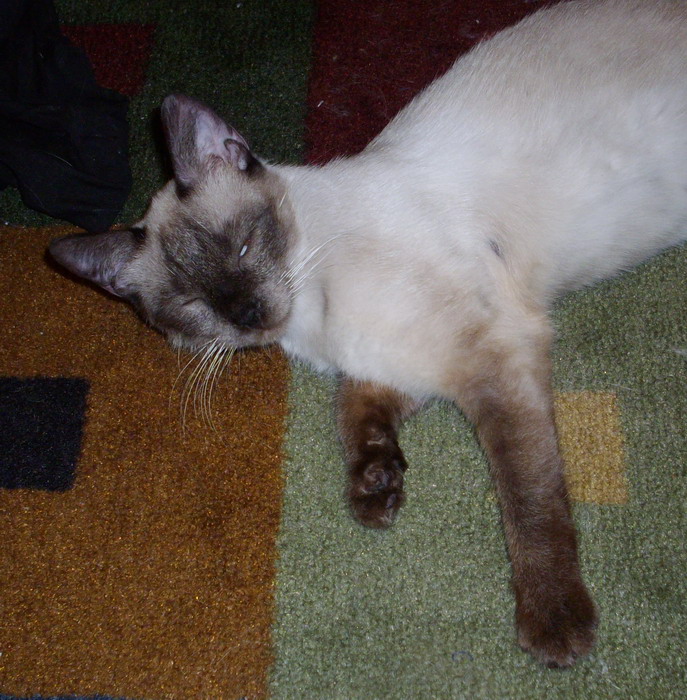
Locate an element on the screen. This screenshot has width=687, height=700. black spot in brown rug is located at coordinates (47, 456).